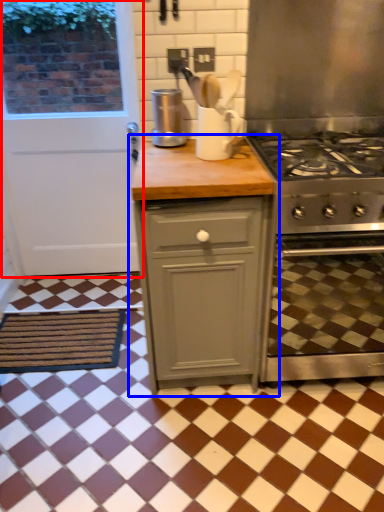
Question: Which object is further to the camera taking this photo, door (highlighted by a red box) or cabinetry (highlighted by a blue box)?

Choices:
 (A) door
 (B) cabinetry

Answer: (A)